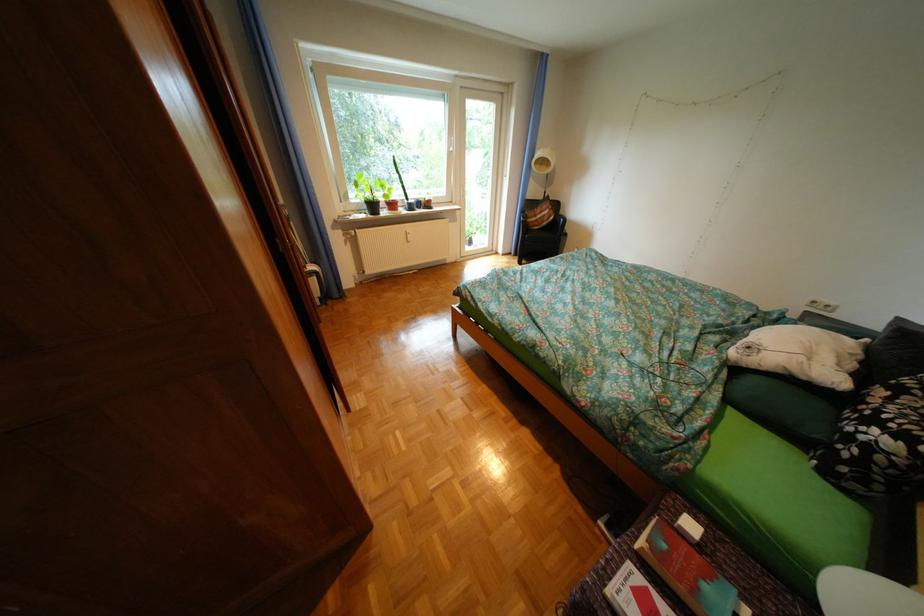
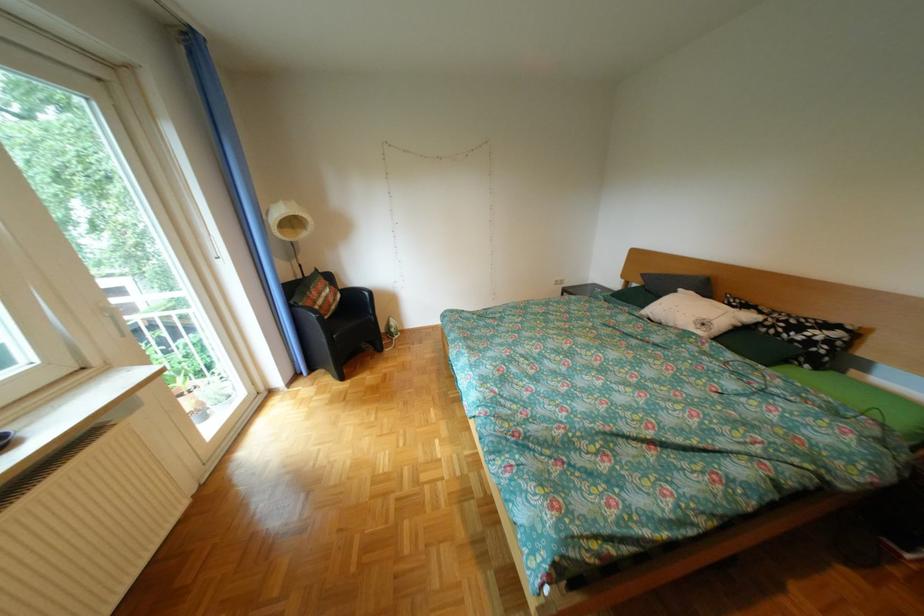
Where in the second image is the point corresponding to the point at 537,213 from the first image?

(306, 307)